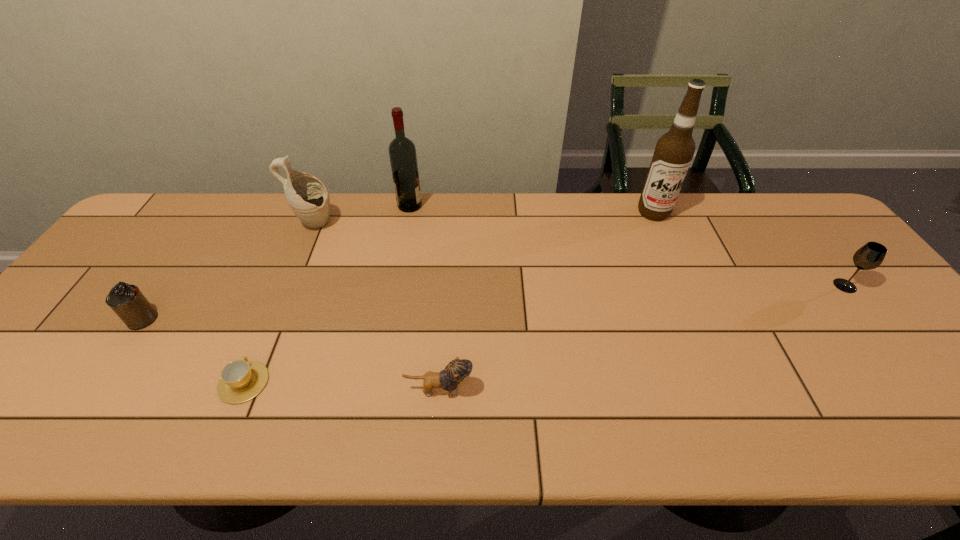
This screenshot has width=960, height=540. I want to click on free space between the rightmost object and the second object from right to left, so click(749, 249).

Locate an element on the screen. free space between the shortest object and the kitten is located at coordinates (342, 386).

The height and width of the screenshot is (540, 960). Find the location of `empty space that is in between the third nearest object and the cup`. empty space that is in between the third nearest object and the cup is located at coordinates (193, 351).

You are a GUI agent. You are given a task and a screenshot of the screen. Output one action in this format:
    pyautogui.click(x=<x>, y=<y>)
    Task: Click on the vacant area that lies between the fifth shortest object and the fifth object from left to right
    The image size is (960, 540).
    Given the screenshot: What is the action you would take?
    pyautogui.click(x=376, y=307)

This screenshot has height=540, width=960. What are the coordinates of `vacant area that lies between the pitcher and the fifth object from left to right` in the screenshot? It's located at click(x=376, y=307).

The width and height of the screenshot is (960, 540). I want to click on vacant space that's between the leftmost object and the cup, so click(193, 351).

Locate an element on the screen. free space that is in between the fourth object from left to right and the taller alcohol is located at coordinates coord(532,209).

Identify which object is the third nearest to the fourth tallest object. Please provide its 2D coordinates. Your answer should be formatted as a tuple, i.e. [(x, y)], where the tuple contains the x and y coordinates of a point satisfying the conditions above.

[(402, 152)]

Locate which object is the second closest to the second tallest object. Please provide its 2D coordinates. Your answer should be formatted as a tuple, i.e. [(x, y)], where the tuple contains the x and y coordinates of a point satisfying the conditions above.

[(241, 380)]

In order to click on vacant space that satisfies the following two spatial constraints: 1. at the spout of the fifth shortest object; 2. on the left side of the wineglass in this screenshot , I will do `click(289, 286)`.